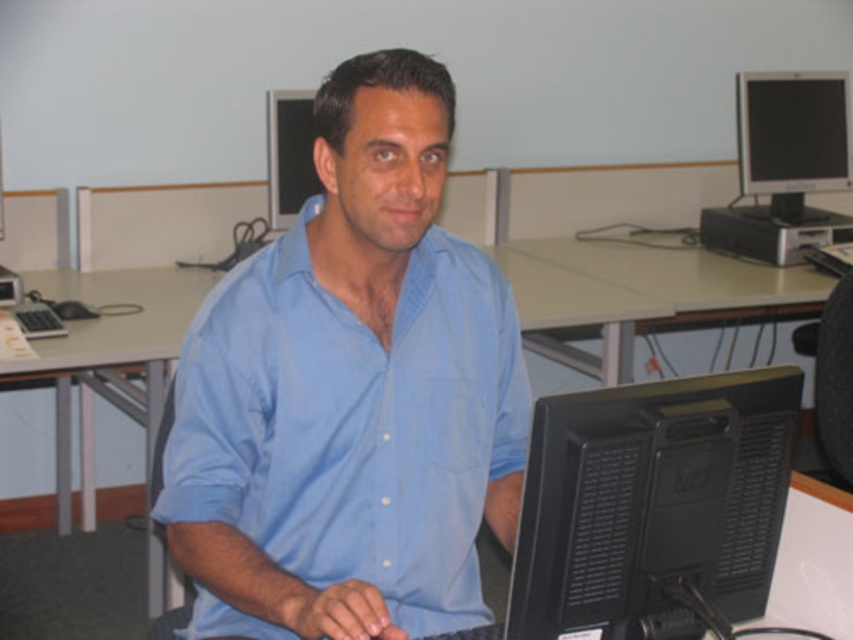
You are standing in front of the desk in the computer lab. The monitor is at the center. If you want to place a new keyboard exactly where the black matte monitor at center is currently located, would that be possible? Please explain why or why not based on the scene description.

The black matte monitor at center is located at point (653, 500). Since the monitor is already occupying that position, placing a new keyboard there would not be possible without moving the existing monitor.